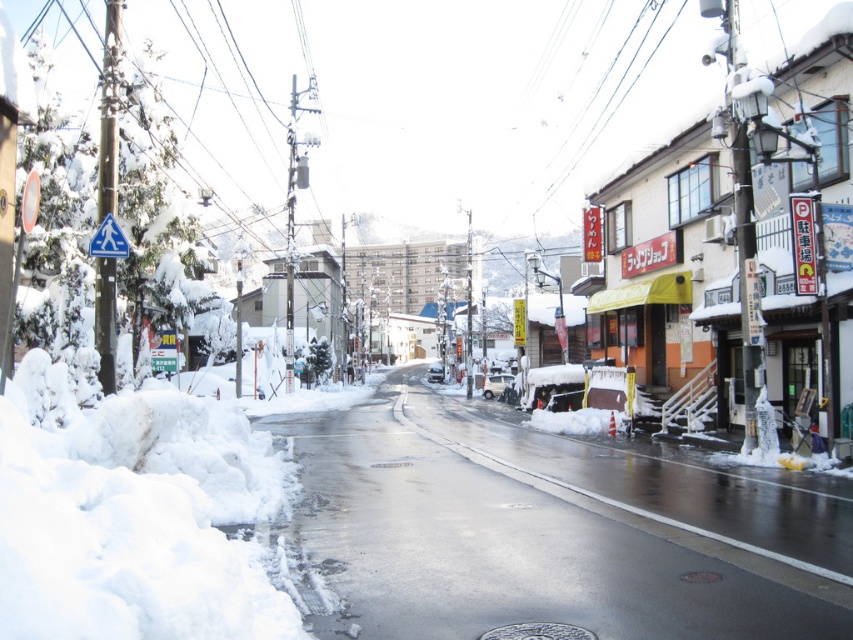
Is silver metallic manhole cover at center smaller than gray metallic manhole cover at center?

Indeed, silver metallic manhole cover at center has a smaller size compared to gray metallic manhole cover at center.

Is silver metallic manhole cover at center bigger than gray metallic manhole cover at center?

No, silver metallic manhole cover at center is not bigger than gray metallic manhole cover at center.

In order to click on silver metallic manhole cover at center in this screenshot , I will do `click(538, 632)`.

Locate an element on the screen. The width and height of the screenshot is (853, 640). silver metallic manhole cover at center is located at coordinates (538, 632).

Who is taller, white fluffy snow at lower left or brown textured manhole cover at center?

Standing taller between the two is white fluffy snow at lower left.

Can you confirm if white fluffy snow at lower left is bigger than brown textured manhole cover at center?

Yes.

Describe the element at coordinates (137, 524) in the screenshot. The width and height of the screenshot is (853, 640). I see `white fluffy snow at lower left` at that location.

Locate an element on the screen. white fluffy snow at lower left is located at coordinates (137, 524).

Can you confirm if silver metallic manhole cover at center is shorter than brown textured manhole cover at center?

No, silver metallic manhole cover at center is not shorter than brown textured manhole cover at center.

Does silver metallic manhole cover at center appear under brown textured manhole cover at center?

Correct, silver metallic manhole cover at center is located below brown textured manhole cover at center.

Is point (515, 625) behind point (711, 577)?

No, it is not.

This screenshot has width=853, height=640. Identify the location of silver metallic manhole cover at center. (538, 632).